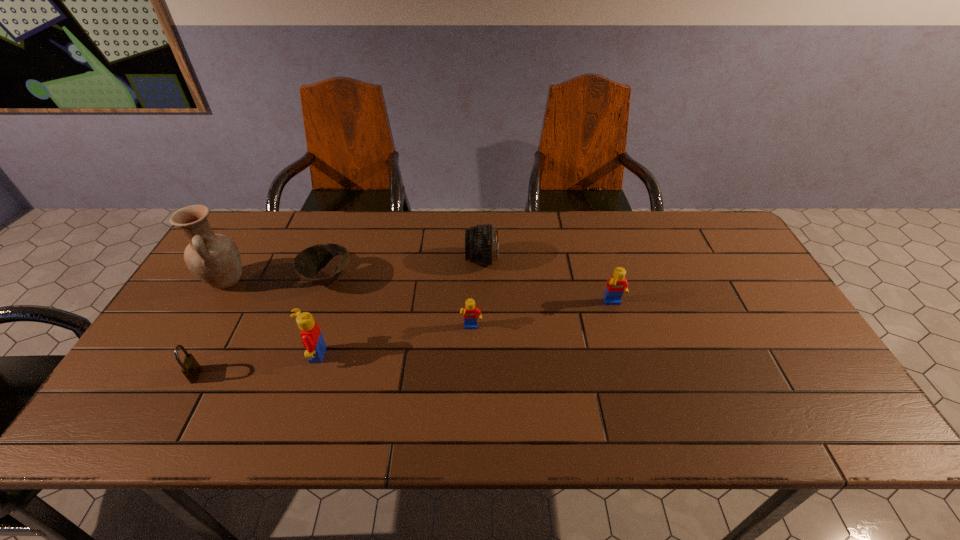
Identify the location of blank space located 0.100m on the face of the nearest Lego. This screenshot has height=540, width=960. (261, 355).

I want to click on vacant area situated on the face of the nearest Lego, so [209, 355].

Locate an element on the screen. free spot located on the face of the nearest Lego is located at coordinates (161, 355).

I want to click on free space located 0.070m on the face of the second nearest Lego, so click(x=470, y=357).

Locate an element on the screen. vacant space situated 0.110m on the face of the farthest Lego is located at coordinates (625, 343).

The height and width of the screenshot is (540, 960). Find the location of `free space located on the right of the tallest object`. free space located on the right of the tallest object is located at coordinates (378, 281).

This screenshot has width=960, height=540. I want to click on vacant space located on the front of the shortest object, so click(292, 382).

Identify the location of free space located 0.200m at the front element of the telephoto lens. The height and width of the screenshot is (540, 960). (x=401, y=260).

Find the location of a particular element. This screenshot has height=540, width=960. vacant point located 0.380m at the front element of the telephoto lens is located at coordinates click(343, 260).

The height and width of the screenshot is (540, 960). I want to click on vacant region located 0.260m at the front element of the telephoto lens, so click(x=382, y=260).